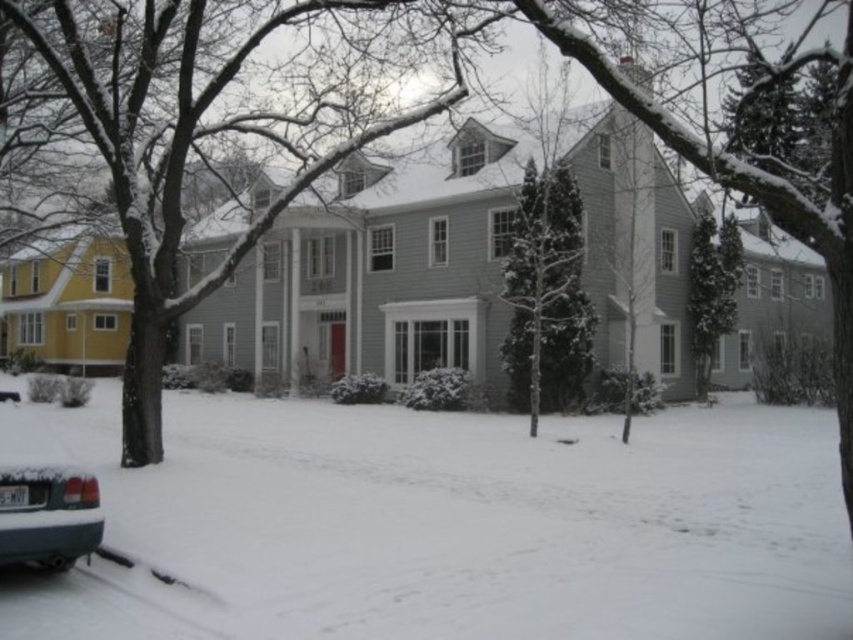
You are standing on the porch of the house and want to walk to the white fluffy snow at lower left and the metallic gray sedan at lower left. Which object is closer to you?

The white fluffy snow at lower left is located below the metallic gray sedan at lower left, so the metallic gray sedan at lower left is closer to you than the white fluffy snow at lower left.

You are standing at the point marked by the coordinate point at (x=457, y=525). Looking towards the house, which direction should you walk to reach the red door?

The point marked by the coordinate point at (x=457, y=525) is located at the white fluffy snow at lower left. To reach the red door on the house, you should walk towards the upper right direction from your current position.